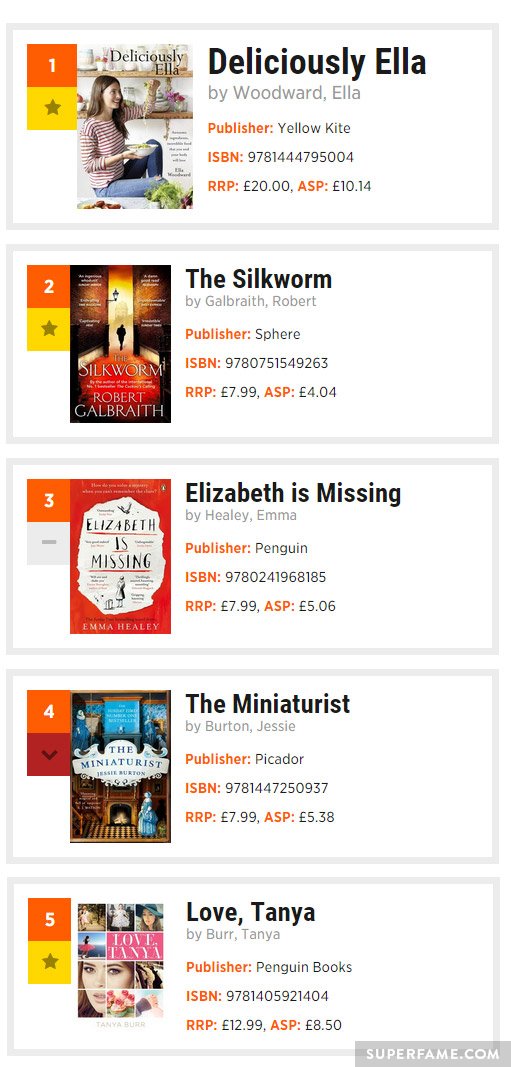
At what (x,y) coordinates should I click in order to perform the action: click on books. Please return your answer as a coordinate pair (x, y). The height and width of the screenshot is (1067, 511). Looking at the image, I should click on (172, 141), (115, 329), (130, 496), (112, 768), (124, 964).